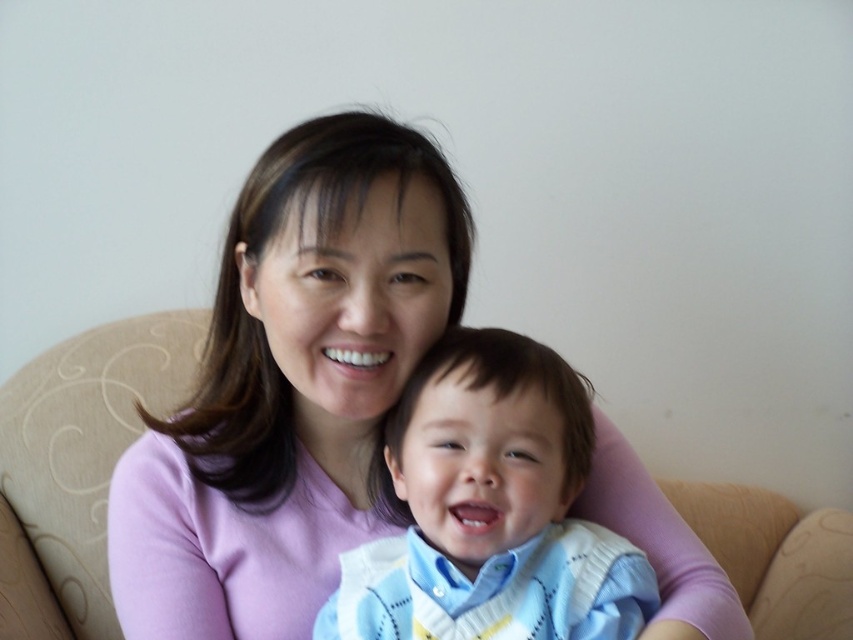
Question: Does pink soft sweater at center have a larger size compared to light blue sweater at center?

Choices:
 (A) yes
 (B) no

Answer: (A)

Question: Considering the relative positions of pink soft sweater at center and light blue sweater at center in the image provided, where is pink soft sweater at center located with respect to light blue sweater at center?

Choices:
 (A) left
 (B) right

Answer: (A)

Question: Considering the relative positions of pink soft sweater at center and light blue sweater at center in the image provided, where is pink soft sweater at center located with respect to light blue sweater at center?

Choices:
 (A) below
 (B) above

Answer: (B)

Question: Which point is farther to the camera?

Choices:
 (A) (532, 456)
 (B) (296, 413)

Answer: (B)